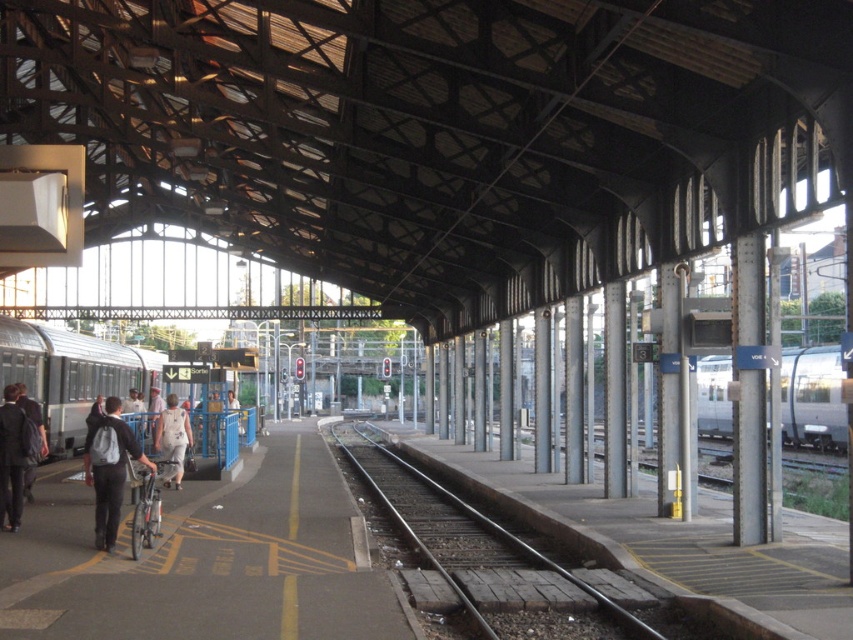
You are standing on the train station platform and want to take a photo of the two points mentioned. Which point, point (148, 362) or point (106, 456), will appear closer to the camera in your photo?

Point (106, 456) will appear closer to the camera in the photo because it is physically closer to the camera than point (148, 362), which is further away.

You are standing at the center of the train station platform and see the dark gray backpack at lower left. Can you estimate its position relative to your current location using the platform coordinates?

The dark gray backpack at lower left is located at point (109, 468) on the platform coordinates, so it is positioned to the lower left from your current location at the center.

You are standing at the point marked as point (x=70, y=374) on the platform. What object is exactly at that point?

The silver metallic train at left is exactly at point (x=70, y=374).